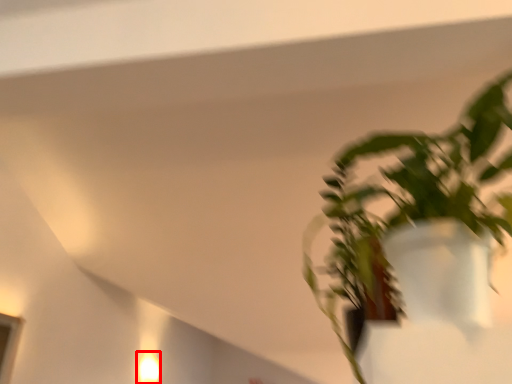
Question: In this image, where is light fixture (annotated by the red box) located relative to houseplant?

Choices:
 (A) left
 (B) right

Answer: (A)